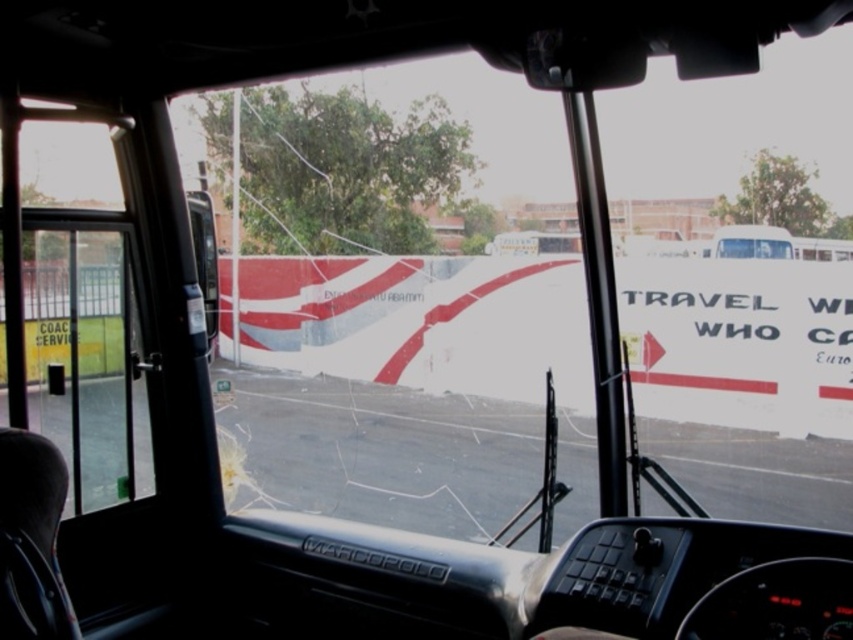
Does transparent glass at center have a lesser height compared to white glossy bus driver at center?

Incorrect, transparent glass at center's height does not fall short of white glossy bus driver at center's.

Based on the photo, between transparent glass at center and white glossy bus driver at center, which one has less height?

white glossy bus driver at center

Where is `transparent glass at center`? transparent glass at center is located at coordinates (398, 294).

Does point (62, 188) come behind point (770, 246)?

No, (62, 188) is closer to viewer.

Can you confirm if clear glass door at left is taller than white glossy bus driver at center?

Correct, clear glass door at left is much taller as white glossy bus driver at center.

Find the location of a particular element. clear glass door at left is located at coordinates (73, 300).

Does transparent glass at center appear on the left side of clear glass door at left?

No, transparent glass at center is not to the left of clear glass door at left.

Is point (315, 193) more distant than point (103, 298)?

Yes.

Between point (469, 378) and point (61, 301), which one is positioned behind?

Positioned behind is point (469, 378).

Where is `transparent glass at center`? transparent glass at center is located at coordinates (398, 294).